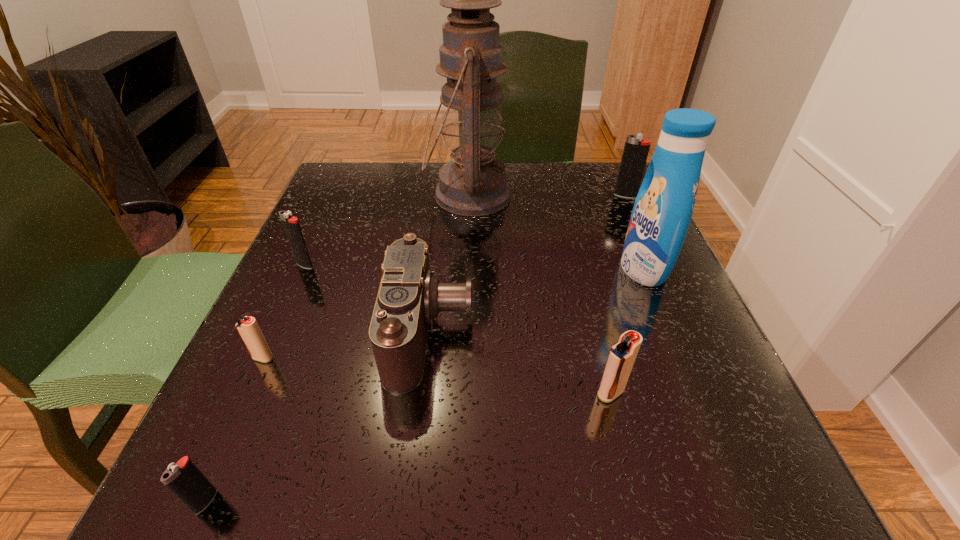
The image size is (960, 540). What are the coordinates of `vacant position located on the front of the fourth nearest igniter` in the screenshot? It's located at (264, 353).

I want to click on vacant region located 0.090m on the left of the nearer red igniter, so click(534, 393).

Where is `vacant space situated on the right of the farther red igniter`? The image size is (960, 540). vacant space situated on the right of the farther red igniter is located at coordinates (358, 358).

I want to click on free region located 0.290m on the back of the nearest igniter, so click(x=289, y=314).

Locate an element on the screen. oil lamp at the far edge is located at coordinates (473, 183).

Image resolution: width=960 pixels, height=540 pixels. Find the location of `igniter at the far edge`. igniter at the far edge is located at coordinates [636, 149].

Find the location of `object present at the near edge`. object present at the near edge is located at coordinates (184, 479).

I want to click on detergent that is at the right edge, so click(663, 208).

Locate an element on the screen. The width and height of the screenshot is (960, 540). object present at the near left corner is located at coordinates 184,479.

Find the location of `object at the far right corner`. object at the far right corner is located at coordinates (636, 149).